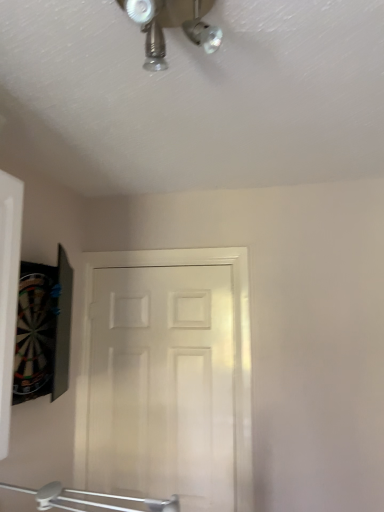
Question: Does point (172, 13) appear closer or farther from the camera than point (231, 504)?

Choices:
 (A) closer
 (B) farther

Answer: (A)

Question: From a real-world perspective, is metallic chrome mechanical fan at upper center physically located above or below white matte door at center?

Choices:
 (A) above
 (B) below

Answer: (A)

Question: From the image's perspective, relative to white matte door at center, is metallic chrome mechanical fan at upper center above or below?

Choices:
 (A) above
 (B) below

Answer: (A)

Question: From a real-world perspective, is white matte door at center physically located above or below metallic chrome mechanical fan at upper center?

Choices:
 (A) below
 (B) above

Answer: (A)

Question: Considering the positions of white matte door at center and metallic chrome mechanical fan at upper center in the image, is white matte door at center wider or thinner than metallic chrome mechanical fan at upper center?

Choices:
 (A) wide
 (B) thin

Answer: (B)

Question: Is point click(241, 263) closer or farther from the camera than point click(132, 7)?

Choices:
 (A) farther
 (B) closer

Answer: (A)

Question: In terms of height, does white matte door at center look taller or shorter compared to metallic chrome mechanical fan at upper center?

Choices:
 (A) short
 (B) tall

Answer: (B)